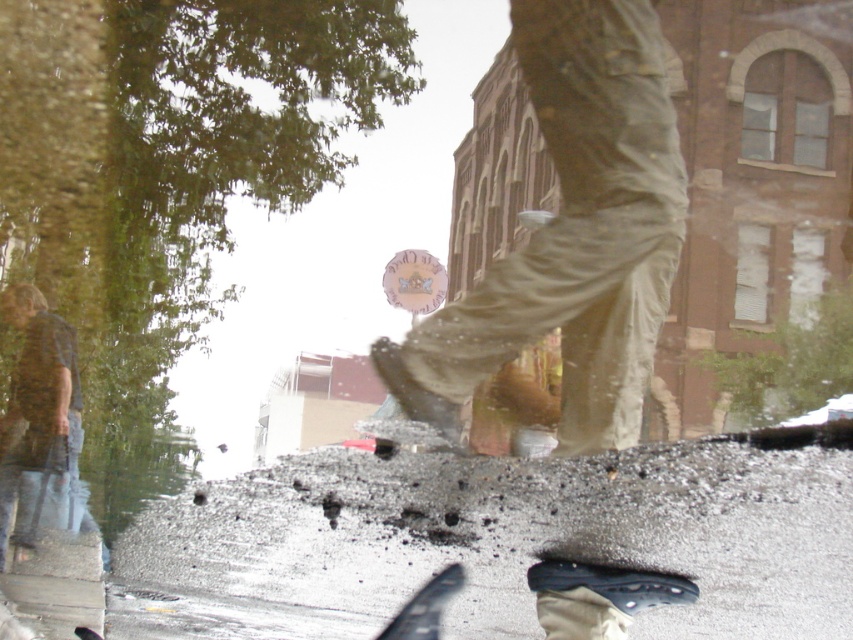
Can you confirm if khaki pants at center is positioned above denim jeans at left?

Yes.

Can you confirm if khaki pants at center is wider than denim jeans at left?

Correct, the width of khaki pants at center exceeds that of denim jeans at left.

Does point (543, 268) come closer to viewer compared to point (7, 310)?

Yes, point (543, 268) is closer to viewer.

Where is `khaki pants at center`? Image resolution: width=853 pixels, height=640 pixels. khaki pants at center is located at coordinates (572, 234).

What do you see at coordinates (498, 540) in the screenshot? This screenshot has height=640, width=853. I see `dark gray asphalt at lower center` at bounding box center [498, 540].

Does point (223, 605) come behind point (508, 269)?

Yes.

Describe the element at coordinates (498, 540) in the screenshot. I see `dark gray asphalt at lower center` at that location.

Locate an element on the screen. dark gray asphalt at lower center is located at coordinates (498, 540).

Is dark gray asphalt at lower center thinner than denim jeans at left?

No, dark gray asphalt at lower center is not thinner than denim jeans at left.

Based on the photo, between dark gray asphalt at lower center and denim jeans at left, which one is positioned lower?

dark gray asphalt at lower center is lower down.

Between point (746, 628) and point (73, 387), which one is positioned in front?

Point (746, 628) is more forward.

At what (x,y) coordinates should I click in order to perform the action: click on dark gray asphalt at lower center. Please return your answer as a coordinate pair (x, y). The height and width of the screenshot is (640, 853). Looking at the image, I should click on (498, 540).